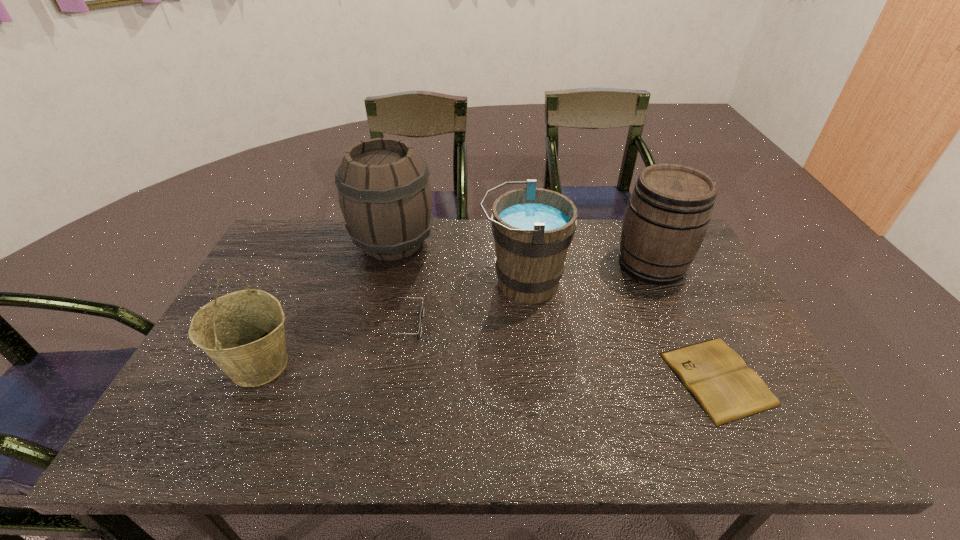
This screenshot has width=960, height=540. I want to click on free point between the shortest object and the second wine bucket from left to right, so [555, 310].

The width and height of the screenshot is (960, 540). I want to click on free space between the book and the fourth object from left to right, so click(620, 331).

You are a GUI agent. You are given a task and a screenshot of the screen. Output one action in this format:
    pyautogui.click(x=<x>, y=<y>)
    Task: Click on the vacant region between the fifth tallest object and the second wine bucket from left to right
    
    Given the screenshot: What is the action you would take?
    pyautogui.click(x=396, y=283)

Locate an element on the screen. This screenshot has width=960, height=540. empty space that is in between the sunglasses and the second wine bucket from left to right is located at coordinates (396, 283).

You are a GUI agent. You are given a task and a screenshot of the screen. Output one action in this format:
    pyautogui.click(x=<x>, y=<y>)
    Task: Click on the free space between the second wine bucket from left to right and the nearest wine bucket
    
    Given the screenshot: What is the action you would take?
    pyautogui.click(x=327, y=303)

The image size is (960, 540). Find the location of `free space between the leftmost object and the second shortest object`. free space between the leftmost object and the second shortest object is located at coordinates (330, 344).

Identify which object is the closest to the second wine bucket from left to right. Please provide its 2D coordinates. Your answer should be formatted as a tuple, i.e. [(x, y)], where the tuple contains the x and y coordinates of a point satisfying the conditions above.

[(533, 227)]

The height and width of the screenshot is (540, 960). Find the location of `the third closest object to the nearest wine bucket`. the third closest object to the nearest wine bucket is located at coordinates (533, 227).

The width and height of the screenshot is (960, 540). I want to click on wine bucket that stands as the second closest to the sunglasses, so click(x=385, y=196).

This screenshot has width=960, height=540. I want to click on wine bucket that is the closest to the third wine bucket from right to left, so click(x=533, y=227).